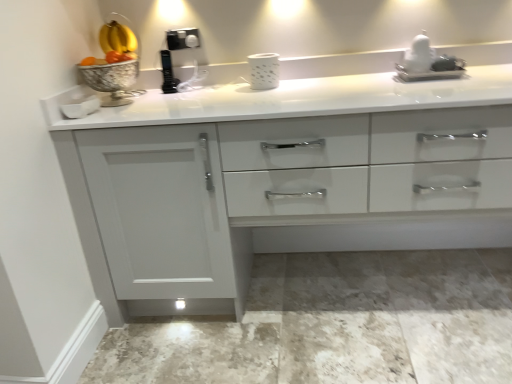
Question: Would you say white glossy statue at upper right is inside or outside white glossy countertop at center?

Choices:
 (A) inside
 (B) outside

Answer: (A)

Question: Considering the positions of white glossy statue at upper right and white glossy countertop at center in the image, is white glossy statue at upper right taller or shorter than white glossy countertop at center?

Choices:
 (A) tall
 (B) short

Answer: (B)

Question: Considering the positions of white glossy statue at upper right and white glossy countertop at center in the image, is white glossy statue at upper right bigger or smaller than white glossy countertop at center?

Choices:
 (A) big
 (B) small

Answer: (B)

Question: Is point (209, 195) closer or farther from the camera than point (417, 77)?

Choices:
 (A) farther
 (B) closer

Answer: (B)

Question: Considering the positions of white glossy countertop at center and white glossy statue at upper right in the image, is white glossy countertop at center bigger or smaller than white glossy statue at upper right?

Choices:
 (A) small
 (B) big

Answer: (B)

Question: Considering the relative positions of white glossy countertop at center and white glossy statue at upper right in the image provided, is white glossy countertop at center to the left or to the right of white glossy statue at upper right?

Choices:
 (A) left
 (B) right

Answer: (A)

Question: Considering their positions, is white glossy countertop at center located in front of or behind white glossy statue at upper right?

Choices:
 (A) front
 (B) behind

Answer: (A)